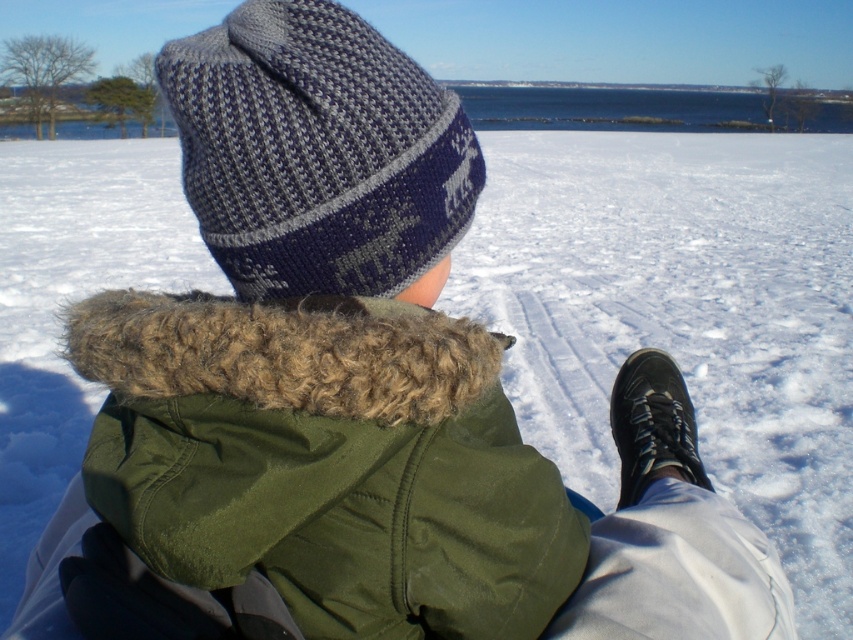
You are a photographer trying to capture a closeup shot of the olive green fabric jacket at center and the knitted woolen hat at upper center in the snowy scene. Your camera lens can only focus on objects within a 5 inch range. Will both items be in focus at the same time?

The olive green fabric jacket at center and the knitted woolen hat at upper center are 6.08 inches apart from each other. Since the distance between them exceeds the camera lens 5 inch focus range, they cannot both be in focus simultaneously.

Consider the image. You are standing in the snowy landscape and want to take a photo. There are two points marked in the image, point A at coordinates point [334,428] and point B at coordinates point [294,131]. Which point is closer to you so that you can focus your camera on it first?

Point point [334,428] is closer to the camera than point point [294,131], so you should focus your camera on point point [334,428] first.

You are a photographer trying to capture the scene with the olive green fabric jacket at center and the knitted woolen hat at upper center. Which object would appear larger in your photo?

The olive green fabric jacket at center would appear larger in the photo because it is closer to the viewer than the knitted woolen hat at upper center.